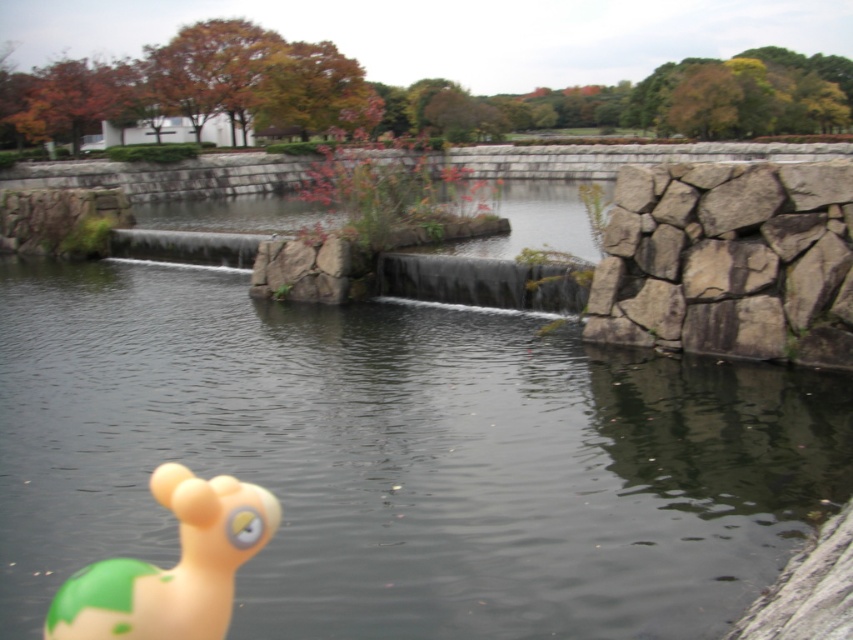
Does gray rough stone at right have a smaller size compared to rubber duck at lower left?

No, gray rough stone at right is not smaller than rubber duck at lower left.

Describe the element at coordinates (729, 260) in the screenshot. I see `gray rough stone at right` at that location.

This screenshot has height=640, width=853. In order to click on gray rough stone at right in this screenshot , I will do `click(729, 260)`.

Which of these two, transparent water at center or gray rough stone at right, stands shorter?

gray rough stone at right is shorter.

Is point (814, 468) farther from camera compared to point (802, 333)?

No, (814, 468) is in front of (802, 333).

Locate an element on the screen. transparent water at center is located at coordinates (401, 458).

In the scene shown: Between transparent water at center and rubber duck at lower left, which one is positioned higher?

Positioned higher is transparent water at center.

Who is more distant from viewer, (22,608) or (152,568)?

Point (22,608)

What do you see at coordinates (401, 458) in the screenshot? I see `transparent water at center` at bounding box center [401, 458].

Image resolution: width=853 pixels, height=640 pixels. Find the location of `transparent water at center`. transparent water at center is located at coordinates (401, 458).